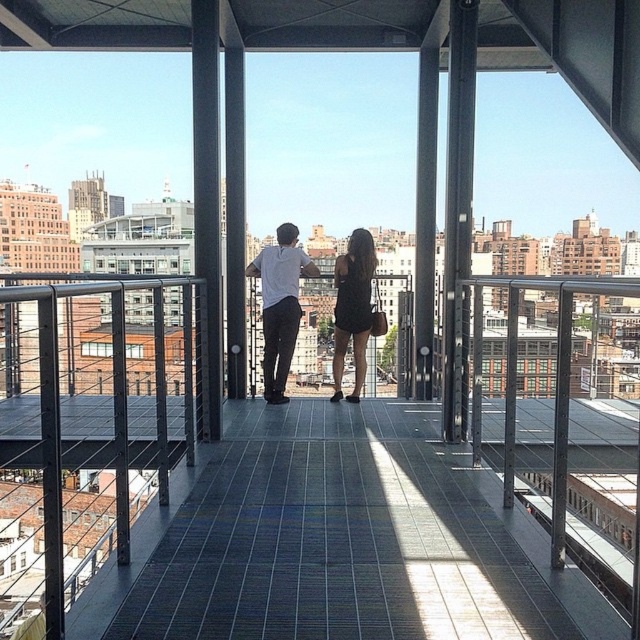
You are a photographer positioned on the rooftop deck. You notice two people wearing a white matte shirt at center and a black matte dress at center. Which clothing item is closer to the camera?

The white matte shirt at center is closer to the camera because it is in front of the black matte dress at center.

From the picture: You are standing on the rooftop and want to reach the metallic gray balcony at center. Given that the average human walking speed is 1.4 meters per second, how many seconds will it take you to walk to the balcony?

The metallic gray balcony at center is 35.01 meters away. At a walking speed of 1.4 meters per second, it would take approximately 25 seconds to reach it.